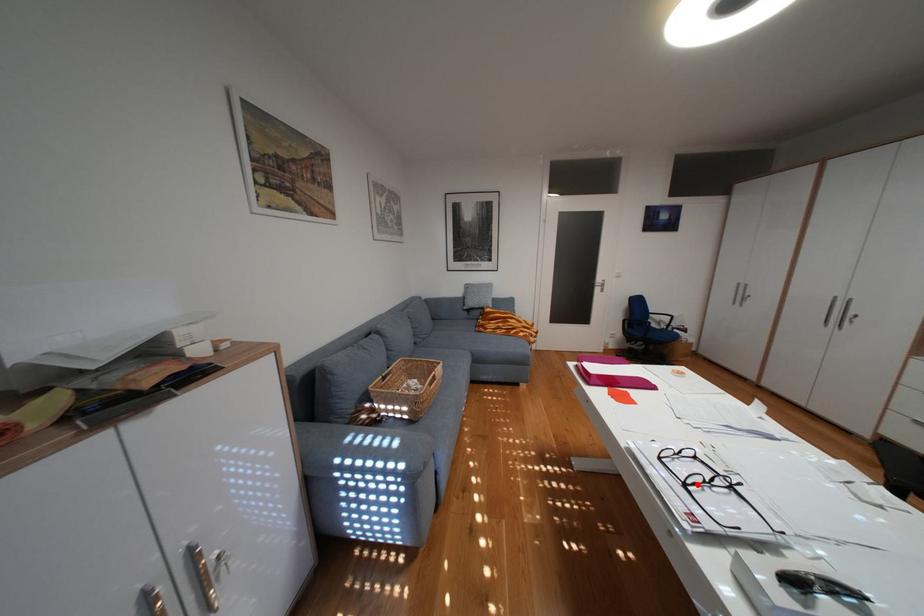
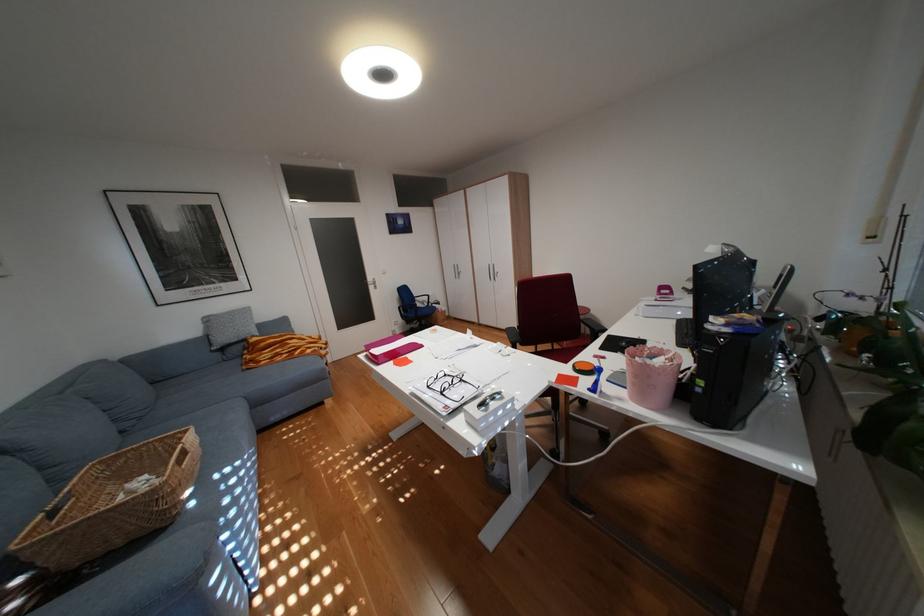
In the second image, find the point that corresponds to the highlighted location in the first image.

(454, 392)